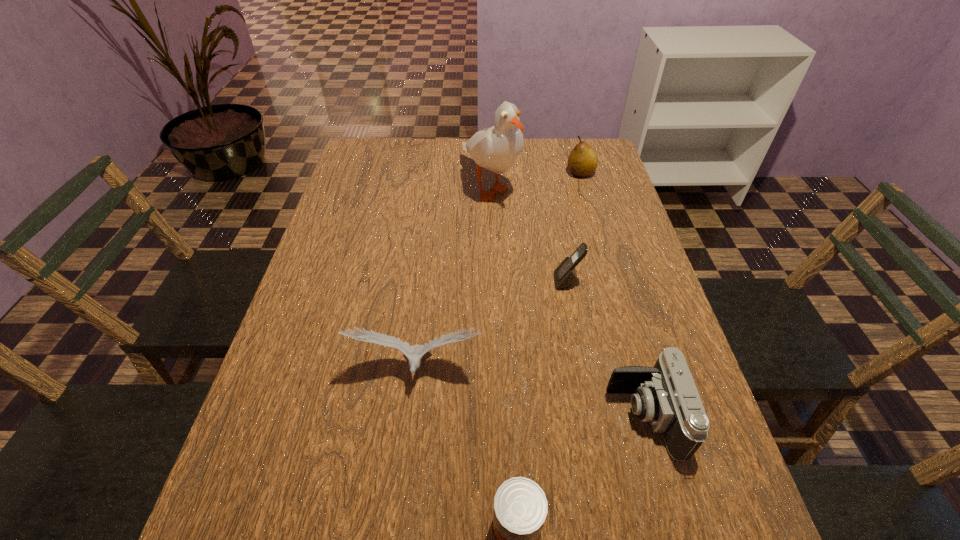
The height and width of the screenshot is (540, 960). I want to click on object that is positioned at the far right corner, so click(582, 162).

You are a GUI agent. You are given a task and a screenshot of the screen. Output one action in this format:
    pyautogui.click(x=<x>, y=<y>)
    Task: Click on the vacant space at the far edge of the desktop
    
    Given the screenshot: What is the action you would take?
    pyautogui.click(x=459, y=153)

Locate an element on the screen. This screenshot has height=540, width=960. vacant space at the left edge of the desktop is located at coordinates (251, 442).

You are a GUI agent. You are given a task and a screenshot of the screen. Output one action in this format:
    pyautogui.click(x=<x>, y=<y>)
    Task: Click on the vacant area at the right edge
    
    Given the screenshot: What is the action you would take?
    pyautogui.click(x=610, y=186)

In the image, there is a desktop. Where is `free space at the far left corner`? The width and height of the screenshot is (960, 540). free space at the far left corner is located at coordinates (370, 146).

Locate an element on the screen. This screenshot has width=960, height=540. vacant area at the far right corner is located at coordinates (612, 176).

Image resolution: width=960 pixels, height=540 pixels. I want to click on free space between the taller gull and the fourth nearest object, so click(x=529, y=234).

Find the location of a particular element. The image size is (960, 540). vacant region between the third object from right to left and the shorter gull is located at coordinates (492, 326).

Find the location of a particular element. free space that is in between the taller gull and the camera is located at coordinates (567, 301).

The height and width of the screenshot is (540, 960). What are the coordinates of `free spot between the pear and the camera` in the screenshot? It's located at (612, 295).